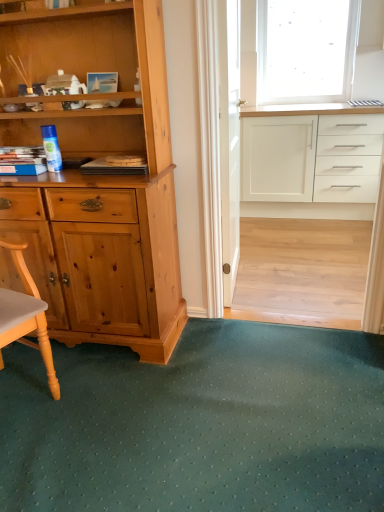
Question: Is transparent frosted glass at upper right positioned with its back to white glossy cabinet at upper right?

Choices:
 (A) yes
 (B) no

Answer: (B)

Question: Considering the relative sizes of transparent frosted glass at upper right and white glossy cabinet at upper right in the image provided, is transparent frosted glass at upper right bigger than white glossy cabinet at upper right?

Choices:
 (A) yes
 (B) no

Answer: (B)

Question: From the image's perspective, is transparent frosted glass at upper right beneath white glossy cabinet at upper right?

Choices:
 (A) no
 (B) yes

Answer: (A)

Question: Considering the relative sizes of transparent frosted glass at upper right and white glossy cabinet at upper right in the image provided, is transparent frosted glass at upper right smaller than white glossy cabinet at upper right?

Choices:
 (A) no
 (B) yes

Answer: (B)

Question: Is transparent frosted glass at upper right further to the viewer compared to white glossy cabinet at upper right?

Choices:
 (A) yes
 (B) no

Answer: (A)

Question: From a real-world perspective, relative to clear glass screen door at center, is green textured mat at lower center vertically above or below?

Choices:
 (A) below
 (B) above

Answer: (A)

Question: Visually, is green textured mat at lower center positioned to the left or to the right of clear glass screen door at center?

Choices:
 (A) right
 (B) left

Answer: (B)

Question: Relative to clear glass screen door at center, is green textured mat at lower center in front or behind?

Choices:
 (A) front
 (B) behind

Answer: (A)

Question: Do you think green textured mat at lower center is within clear glass screen door at center, or outside of it?

Choices:
 (A) outside
 (B) inside

Answer: (A)

Question: In terms of width, does clear glass screen door at center look wider or thinner when compared to white glossy cabinet at upper right?

Choices:
 (A) thin
 (B) wide

Answer: (A)

Question: From a real-world perspective, relative to white glossy cabinet at upper right, is clear glass screen door at center vertically above or below?

Choices:
 (A) below
 (B) above

Answer: (B)

Question: Is clear glass screen door at center inside or outside of white glossy cabinet at upper right?

Choices:
 (A) inside
 (B) outside

Answer: (B)

Question: Based on their positions, is clear glass screen door at center located to the left or right of white glossy cabinet at upper right?

Choices:
 (A) right
 (B) left

Answer: (B)

Question: From a real-world perspective, is transparent frosted glass at upper right above or below green textured mat at lower center?

Choices:
 (A) above
 (B) below

Answer: (A)

Question: From the image's perspective, is transparent frosted glass at upper right located above or below green textured mat at lower center?

Choices:
 (A) below
 (B) above

Answer: (B)